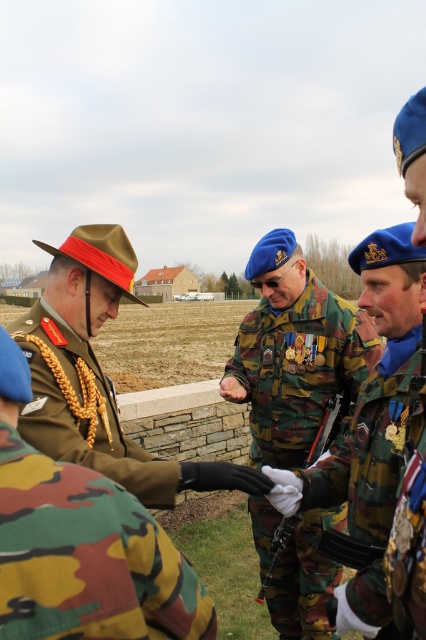
Question: Which point is closer to the camera?

Choices:
 (A) camouflage fabric uniform at center
 (B) camouflage uniform at center

Answer: (B)

Question: Which of the following is the farthest from the observer?

Choices:
 (A) (112, 428)
 (B) (37, 349)

Answer: (A)

Question: Does camouflage fabric uniform at center lie behind green camouflage uniform at center?

Choices:
 (A) no
 (B) yes

Answer: (B)

Question: Does camo fabric uniform at center appear on the left side of green camouflage uniform at center?

Choices:
 (A) no
 (B) yes

Answer: (A)

Question: Among these objects, which one is farthest from the camera?

Choices:
 (A) camouflage fabric uniform at center
 (B) camo fabric uniform at center

Answer: (A)

Question: Is camo fabric uniform at center wider than camouflage fabric uniform at center?

Choices:
 (A) yes
 (B) no

Answer: (B)